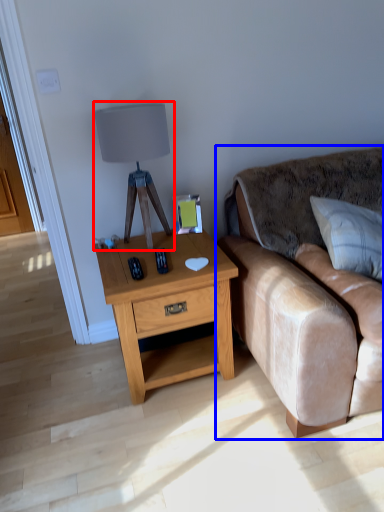
Question: Among these objects, which one is nearest to the camera, table lamp (highlighted by a red box) or studio couch (highlighted by a blue box)?

Choices:
 (A) table lamp
 (B) studio couch

Answer: (B)